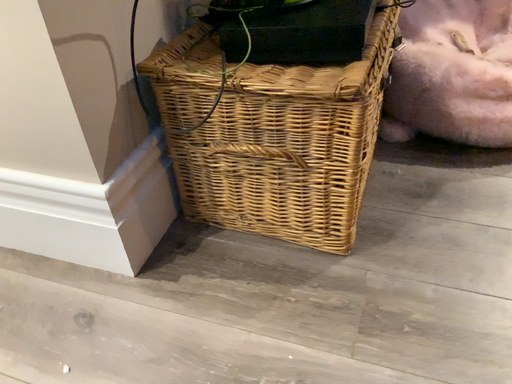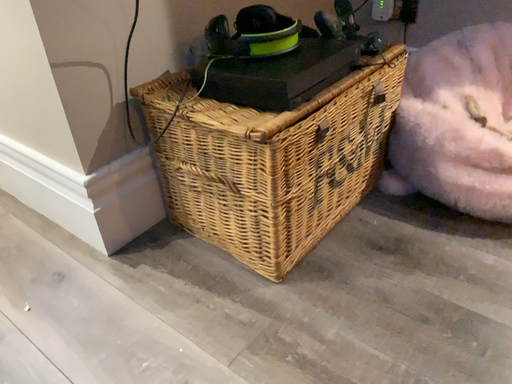
Question: Which way did the camera rotate in the video?

Choices:
 (A) rotated right
 (B) rotated left

Answer: (B)